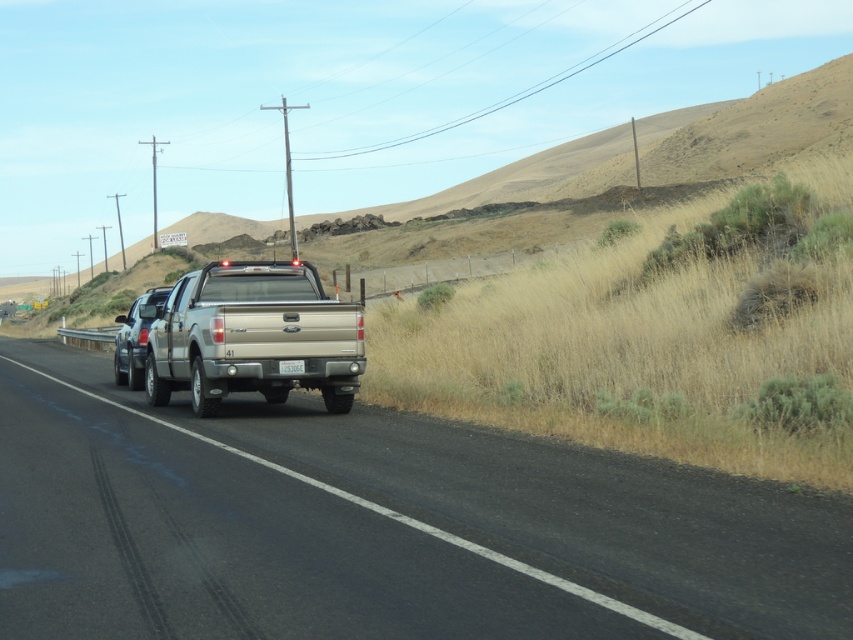
Where is `smooth asphalt road at center`? smooth asphalt road at center is located at coordinates (376, 525).

Can you confirm if smooth asphalt road at center is positioned below silver metallic truck at center?

Yes.

From the picture: Is smooth asphalt road at center to the left of silver metallic truck at center from the viewer's perspective?

No, smooth asphalt road at center is not to the left of silver metallic truck at center.

Describe the element at coordinates (376, 525) in the screenshot. This screenshot has width=853, height=640. I see `smooth asphalt road at center` at that location.

Identify the location of smooth asphalt road at center. (376, 525).

Which is below, smooth asphalt road at center or white plastic license plate at rear?

Positioned lower is smooth asphalt road at center.

Who is positioned more to the right, smooth asphalt road at center or white plastic license plate at rear?

white plastic license plate at rear

Between point (189, 611) and point (303, 365), which one is positioned in front?

Point (189, 611)

Where is `smooth asphalt road at center`? smooth asphalt road at center is located at coordinates (376, 525).